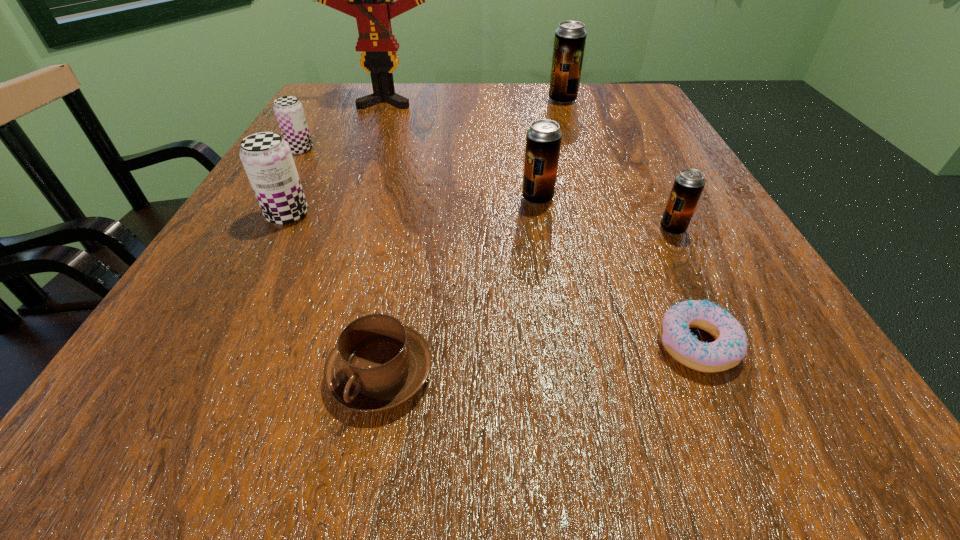
Where is `cappuccino`? The width and height of the screenshot is (960, 540). cappuccino is located at coordinates (378, 364).

Identify the location of the seventh tallest object. This screenshot has width=960, height=540. (378, 364).

At what (x,y) coordinates should I click in order to perform the action: click on purple doughnut. Please return your answer as a coordinate pair (x, y). This screenshot has height=540, width=960. Looking at the image, I should click on (730, 346).

In order to click on the shortest object in this screenshot , I will do `click(730, 346)`.

Identify the location of free spot located on the front-facing side of the tallest object. This screenshot has height=540, width=960. (352, 191).

I want to click on vacant space located 0.350m on the front of the tallest beer can, so click(x=591, y=188).

Locate an element on the screen. The image size is (960, 540). free space located on the back of the third beer can from right to left is located at coordinates (525, 122).

At what (x,y) coordinates should I click in order to perform the action: click on free region located on the back of the bigger purple beer can. Please return your answer as a coordinate pair (x, y). The height and width of the screenshot is (540, 960). Looking at the image, I should click on point(345,107).

Where is `free space located on the front of the second farthest beer can`? Image resolution: width=960 pixels, height=540 pixels. free space located on the front of the second farthest beer can is located at coordinates (271, 199).

This screenshot has width=960, height=540. Find the location of `vacant space located 0.270m on the back of the nearest black beer can`. vacant space located 0.270m on the back of the nearest black beer can is located at coordinates (629, 142).